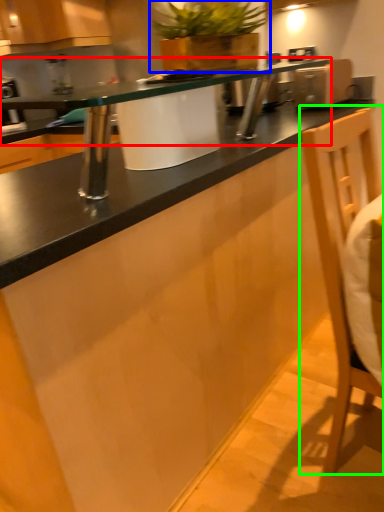
Question: Which object is positioned closest to countertop (highlighted by a red box)? Select from houseplant (highlighted by a blue box) and swivel chair (highlighted by a green box).

Choices:
 (A) houseplant
 (B) swivel chair

Answer: (B)